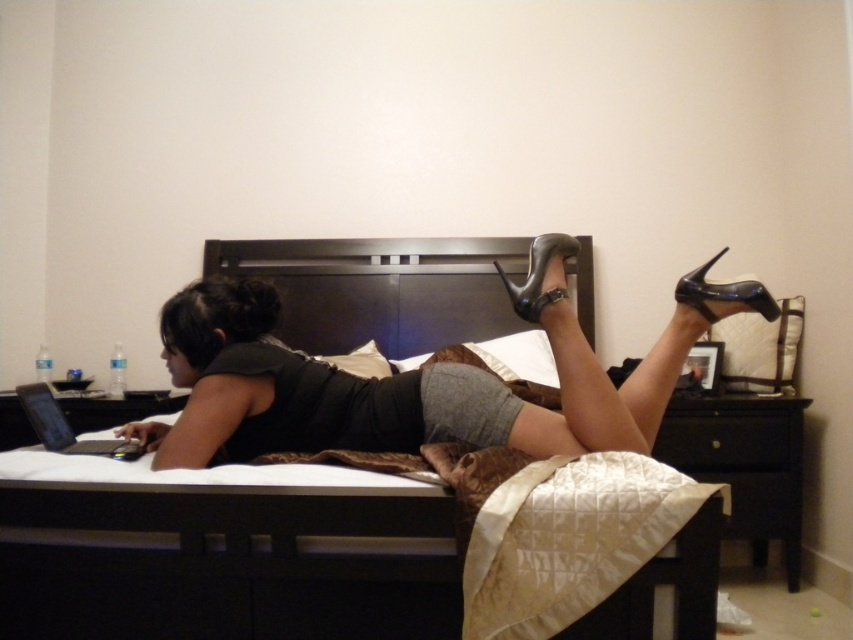
Question: Estimate the real-world distances between objects in this image. Which object is closer to the shiny black high-heeled shoe at upper right?

Choices:
 (A) dark wood bed at center
 (B) shiny black high-heeled shoe at upper center
 (C) matte black high heels at center

Answer: (B)

Question: Does dark wood bed at center appear on the right side of shiny black high-heeled shoe at upper right?

Choices:
 (A) no
 (B) yes

Answer: (A)

Question: Considering the relative positions of dark wood headboard at center and shiny black high-heeled shoe at upper right in the image provided, where is dark wood headboard at center located with respect to shiny black high-heeled shoe at upper right?

Choices:
 (A) above
 (B) below

Answer: (A)

Question: Can you confirm if dark wood headboard at center is positioned to the left of shiny black high-heeled shoe at upper right?

Choices:
 (A) yes
 (B) no

Answer: (A)

Question: Which object is farther from the camera taking this photo?

Choices:
 (A) shiny black high-heeled shoe at upper center
 (B) matte black high heels at center

Answer: (A)

Question: Which of the following is the farthest from the observer?

Choices:
 (A) matte black high heels at center
 (B) dark wood bed at center
 (C) dark wood headboard at center
 (D) shiny black high-heeled shoe at upper right

Answer: (B)